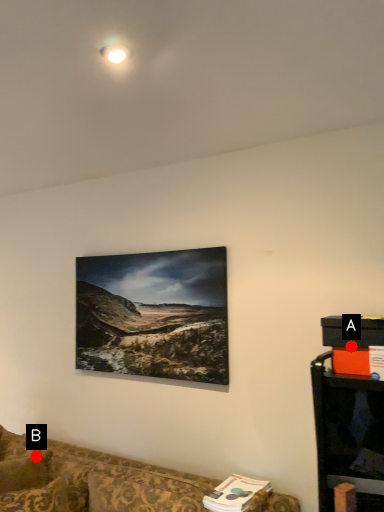
Question: Two points are circled on the image, labeled by A and B beside each circle. Which point is farther from the camera taking this photo?

Choices:
 (A) A is further
 (B) B is further

Answer: (B)